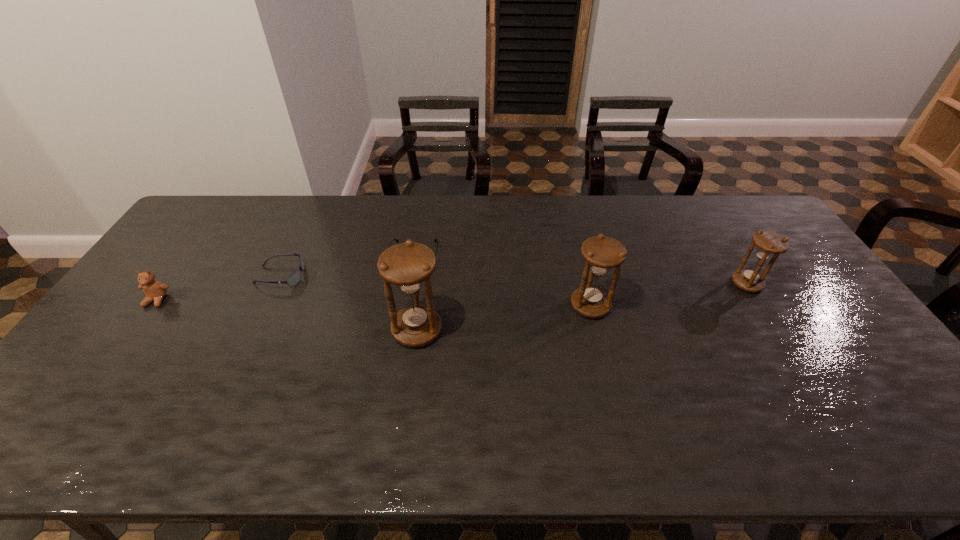
Image resolution: width=960 pixels, height=540 pixels. Find the location of `vacant area that lies between the fifth object from right to left and the second object from right to left`. vacant area that lies between the fifth object from right to left and the second object from right to left is located at coordinates (435, 291).

Locate which object is the second closest to the fifth object from left to right. Please provide its 2D coordinates. Your answer should be formatted as a tuple, i.e. [(x, y)], where the tuple contains the x and y coordinates of a point satisfying the conditions above.

[(769, 244)]

Select which object appears as the fourth closest to the second shortest hourglass. Please provide its 2D coordinates. Your answer should be formatted as a tuple, i.e. [(x, y)], where the tuple contains the x and y coordinates of a point satisfying the conditions above.

[(295, 277)]

Find the location of a particular element. hourglass that is the third nearest to the spectacles is located at coordinates (769, 244).

Identify which hourglass is the nearest to the shortest object. Please provide its 2D coordinates. Your answer should be formatted as a tuple, i.e. [(x, y)], where the tuple contains the x and y coordinates of a point satisfying the conditions above.

[(407, 265)]

The width and height of the screenshot is (960, 540). In order to click on vacant point that satisfies the following two spatial constraints: 1. on the front-facing side of the spectacles; 2. on the lenses of the second object from left to right in this screenshot , I will do `click(411, 276)`.

At what (x,y) coordinates should I click in order to perform the action: click on free location that satisfies the following two spatial constraints: 1. on the lenses of the sunglasses; 2. on the face of the leftmost object. Please return your answer as a coordinate pair (x, y). Looking at the image, I should click on (269, 300).